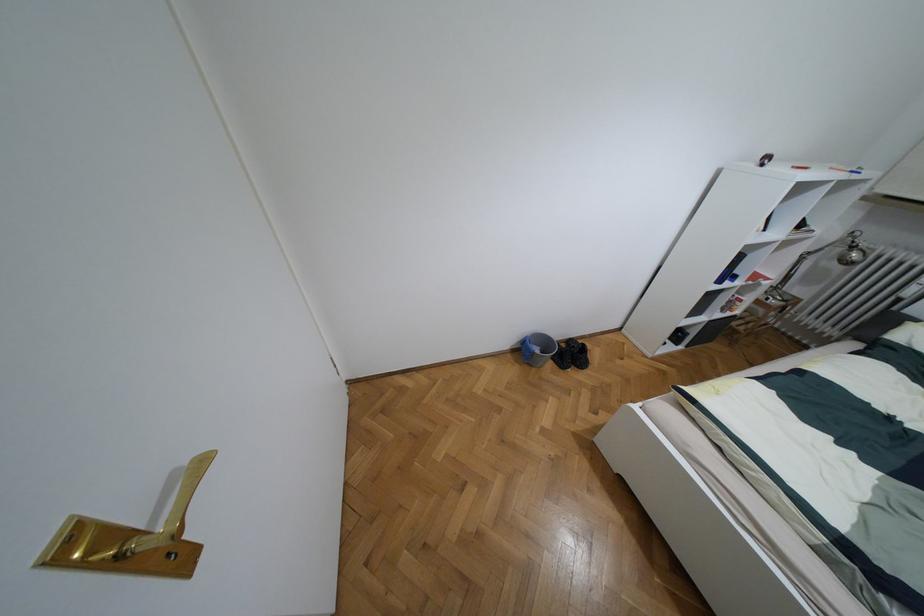
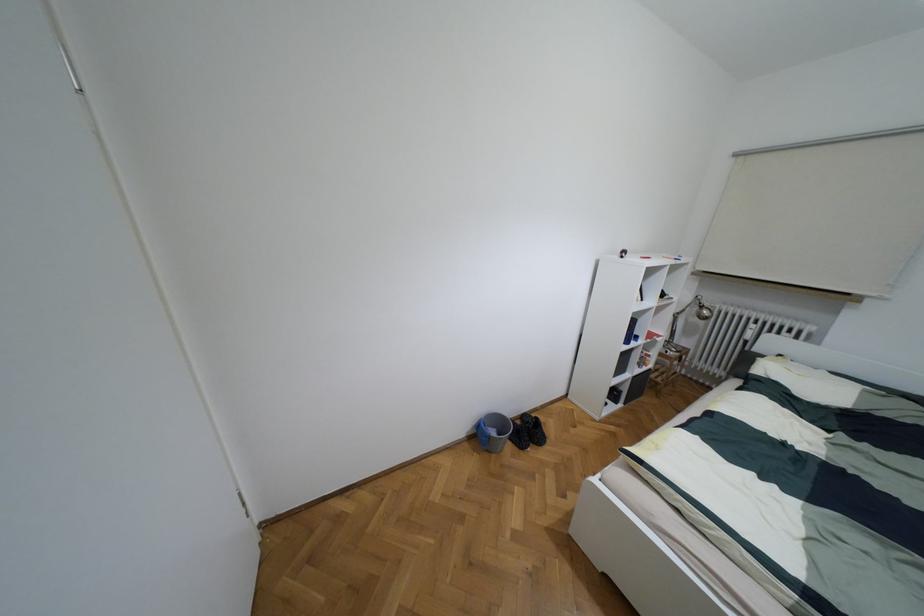
The images are taken continuously from a first-person perspective. In which direction are you moving?

The cameraman walked toward right, backward.